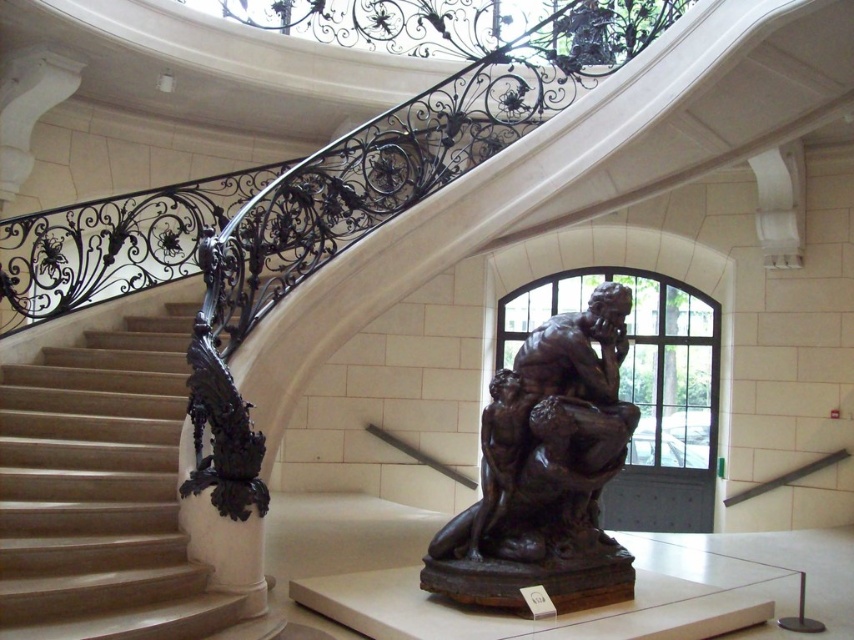
Does polished wood stairs at left have a greater width compared to bronze sculpture at center?

Yes.

Is polished wood stairs at left to the left of bronze sculpture at center from the viewer's perspective?

Correct, you'll find polished wood stairs at left to the left of bronze sculpture at center.

Between point (80, 524) and point (519, 547), which one is positioned in front?

Point (80, 524)

Locate an element on the screen. The height and width of the screenshot is (640, 854). polished wood stairs at left is located at coordinates (103, 492).